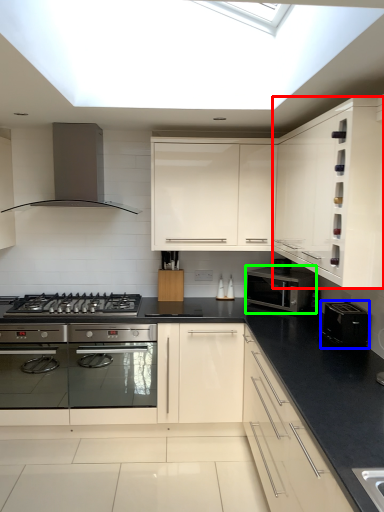
Question: Estimate the real-world distances between objects in this image. Which object is closer to cabinetry (highlighted by a red box), appliance (highlighted by a blue box) or microwave oven (highlighted by a green box)?

Choices:
 (A) appliance
 (B) microwave oven

Answer: (A)